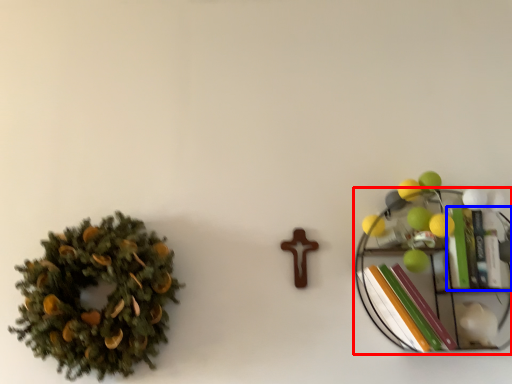
Question: Which object is closer to the camera taking this photo, shelf (highlighted by a red box) or book (highlighted by a blue box)?

Choices:
 (A) shelf
 (B) book

Answer: (A)